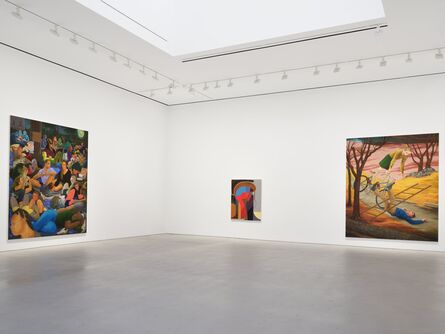
Find the location of a particular element. This screenshot has width=445, height=334. left painting is located at coordinates (33, 188).